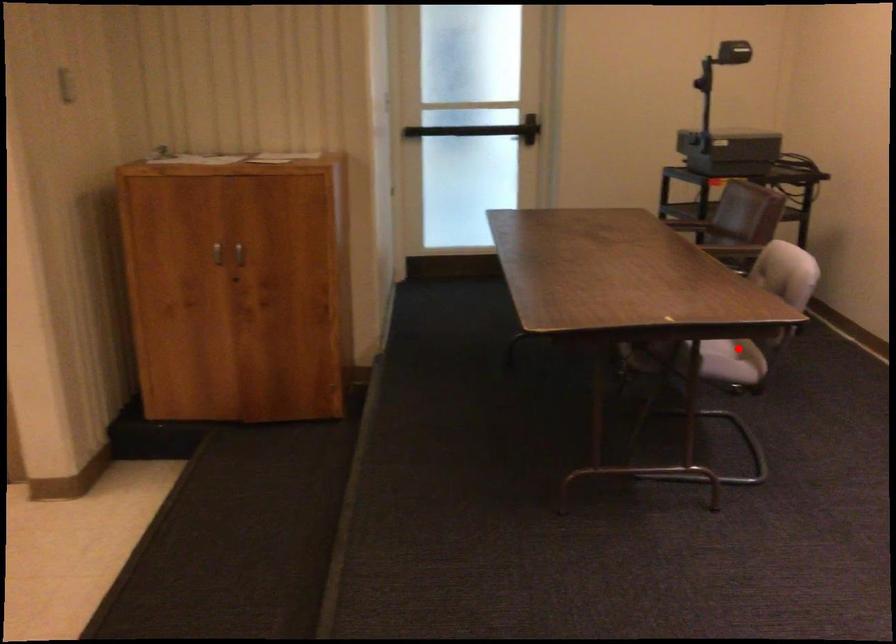
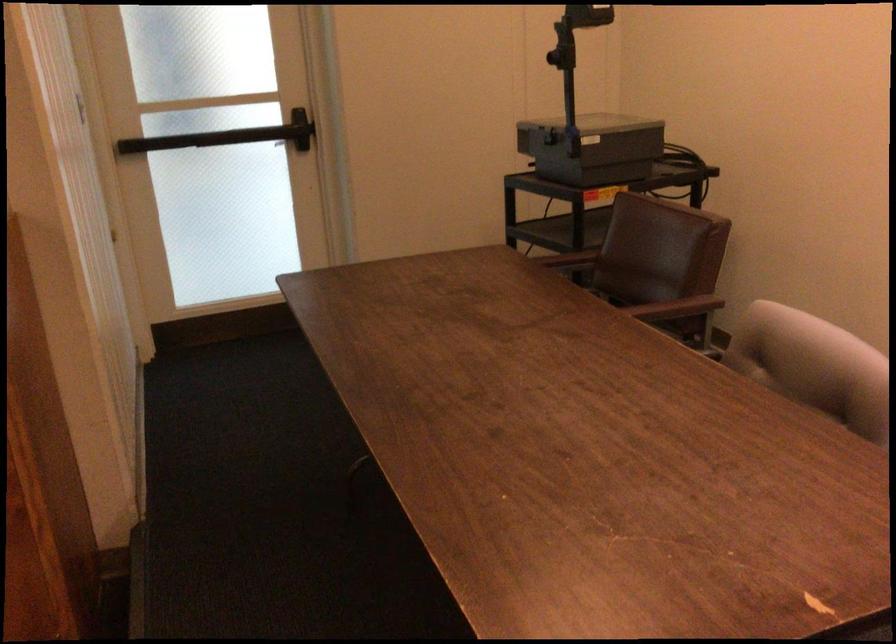
Question: I am providing you with two images of the same scene from different viewpoints. A red point is marked on the first image. Can you still see the location of the red point in image 2?

Choices:
 (A) Yes
 (B) No

Answer: (B)